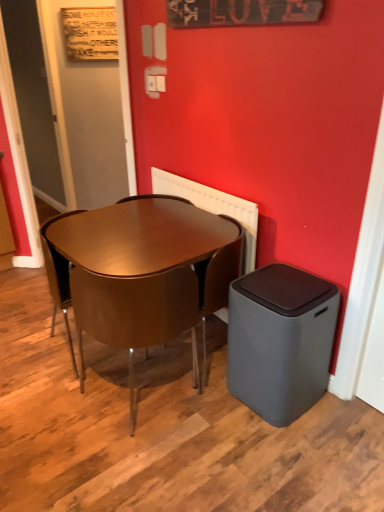
Find the location of a particular element. Image resolution: width=384 pixels, height=512 pixels. vacant space situated above glossy brown chair at center, which is counted as the 1th chair, starting from the left (from a real-world perspective) is located at coordinates 90,220.